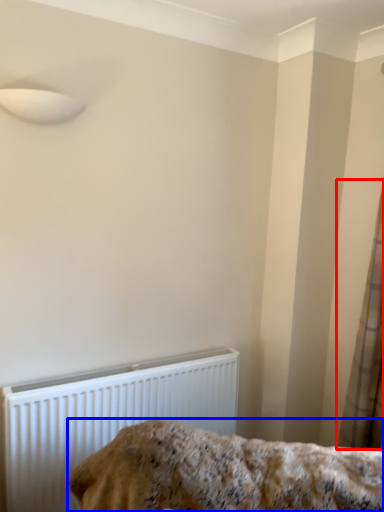
Question: Which of the following is the farthest to the observer, curtain (highlighted by a red box) or furniture (highlighted by a blue box)?

Choices:
 (A) curtain
 (B) furniture

Answer: (A)